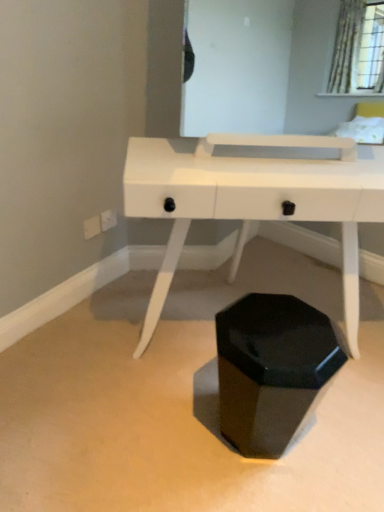
The width and height of the screenshot is (384, 512). In order to click on vacant space situated on the left part of black glossy hexagonal at center in this screenshot , I will do `click(173, 428)`.